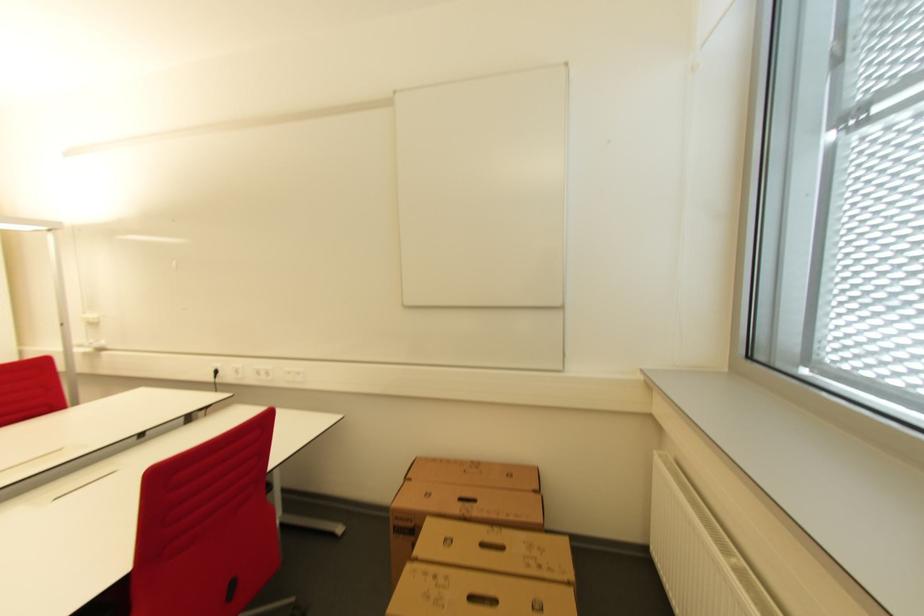
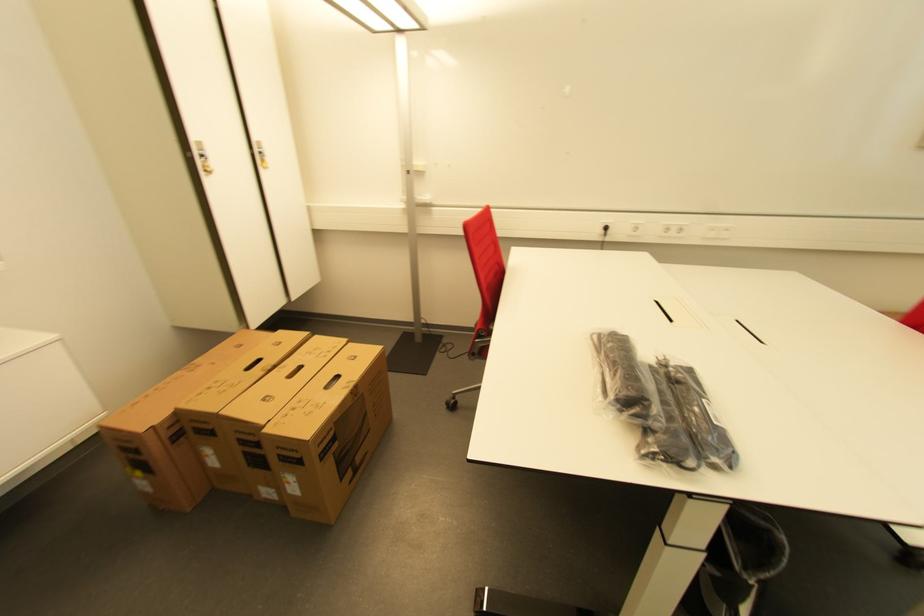
The point at (223, 373) is marked in the first image. Where is the corresponding point in the second image?

(611, 230)